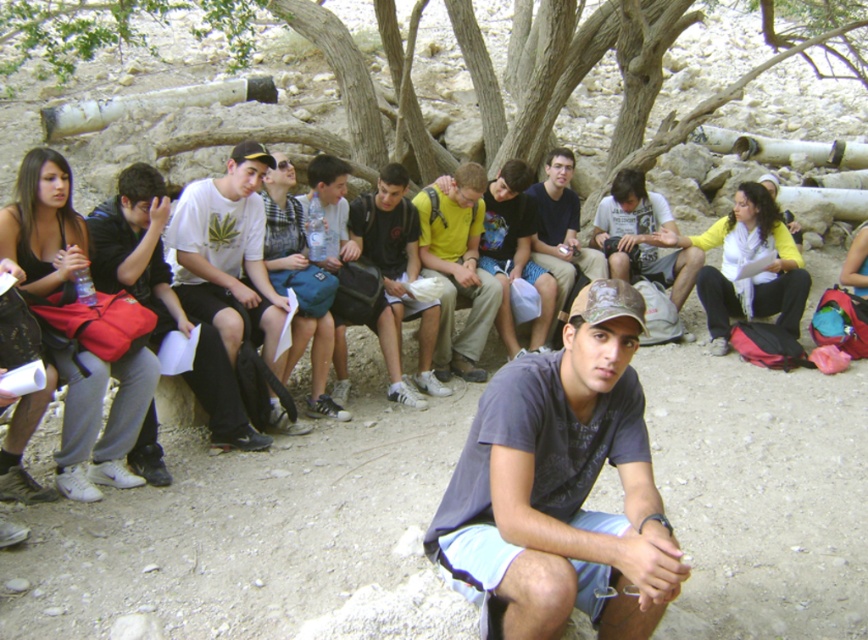
Question: Which of the following is the closest to the observer?

Choices:
 (A) matte black backpack at center
 (B) brown rough tree at upper center
 (C) white matte t-shirt at center
 (D) dark gray t-shirt at center

Answer: (D)

Question: Which point is farther from the camera taking this photo?

Choices:
 (A) (563, 44)
 (B) (142, 164)

Answer: (A)

Question: Estimate the real-world distances between objects in this image. Which object is closer to the matte black shirt at center?

Choices:
 (A) yellow matte shirt at center
 (B) brown rough tree at upper center
 (C) matte black backpack at center
 (D) matte white t-shirt at left

Answer: (A)

Question: Does matte black backpack at center appear over matte black shirt at center?

Choices:
 (A) no
 (B) yes

Answer: (A)

Question: Is matte white t-shirt at left thinner than matte black shirt at center?

Choices:
 (A) no
 (B) yes

Answer: (A)

Question: Does dark gray t-shirt at center have a larger size compared to brown rough tree at upper center?

Choices:
 (A) yes
 (B) no

Answer: (B)